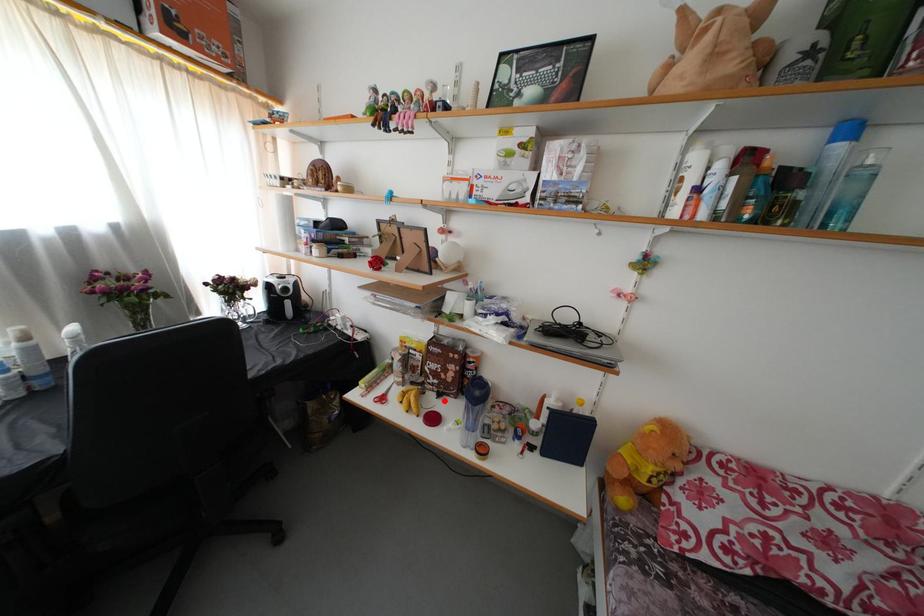
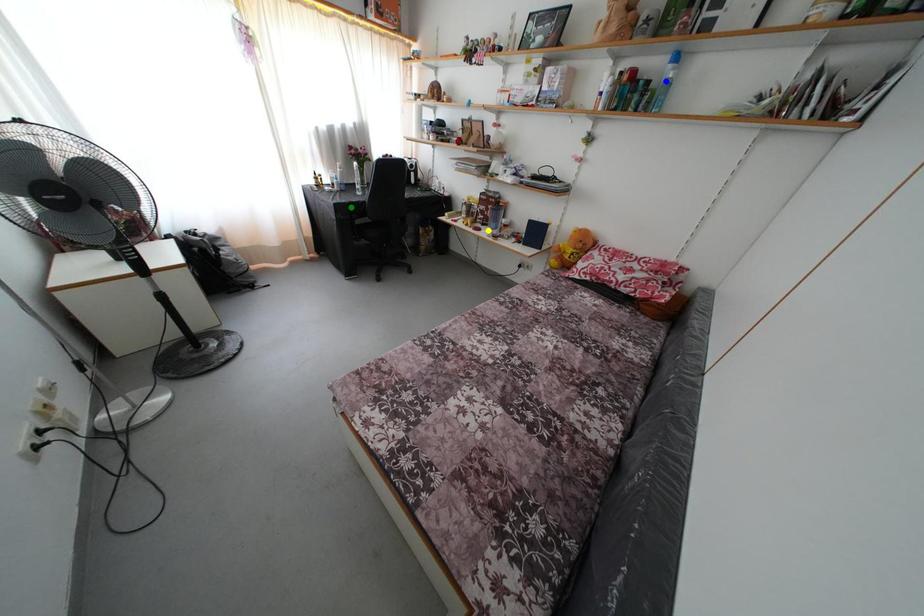
Question: I am providing you with two images of the same scene from different viewpoints. A red point is marked on the first image. You are given multiple points on the second image. Which point in image 2 is actually the same real-world point as the red point in image 1?

Choices:
 (A) yellow point
 (B) green point
 (C) blue point

Answer: (A)